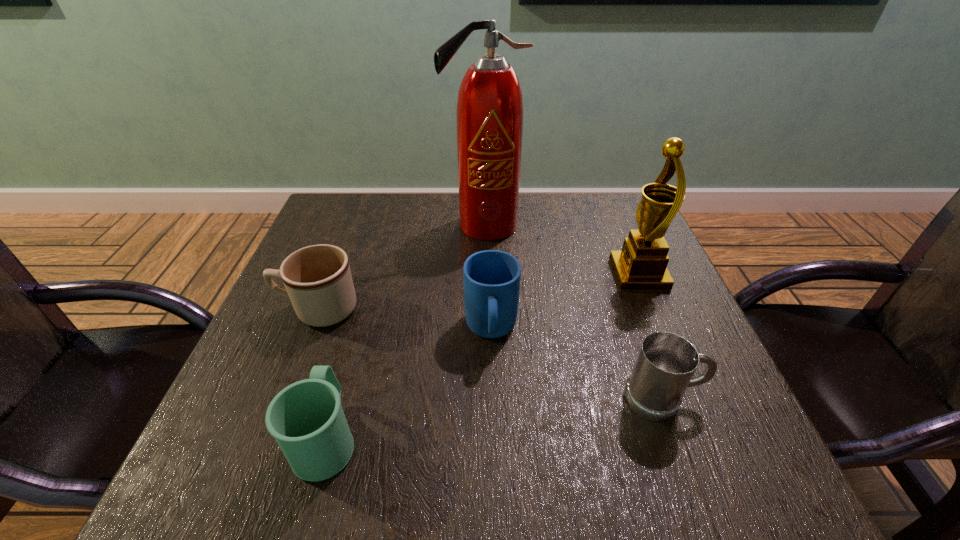
Where is `vacant space located 0.060m on the side of the rightmost mug with the handle`? The width and height of the screenshot is (960, 540). vacant space located 0.060m on the side of the rightmost mug with the handle is located at coordinates (733, 399).

This screenshot has height=540, width=960. I want to click on object situated at the far edge, so click(489, 117).

Find the location of a particular element. object that is at the near edge is located at coordinates coord(306,418).

Find the location of a particular element. The width and height of the screenshot is (960, 540). award that is at the right edge is located at coordinates (642, 264).

Identify the location of mug located at the right edge. This screenshot has width=960, height=540. (666, 362).

Where is `object located at the near left corner`? The height and width of the screenshot is (540, 960). object located at the near left corner is located at coordinates (306, 418).

This screenshot has width=960, height=540. In the image, there is a desktop. Identify the location of free space at the far edge. (540, 239).

Where is `free space at the left edge`? Image resolution: width=960 pixels, height=540 pixels. free space at the left edge is located at coordinates coord(232,420).

This screenshot has height=540, width=960. Identify the location of free space at the right edge. (674, 305).

You are a GUI agent. You are given a task and a screenshot of the screen. Output one action in this format:
    pyautogui.click(x=<x>, y=<y>)
    Task: Click on the free space at the far right corner of the desktop
    This screenshot has width=960, height=540.
    Given the screenshot: What is the action you would take?
    click(x=622, y=195)